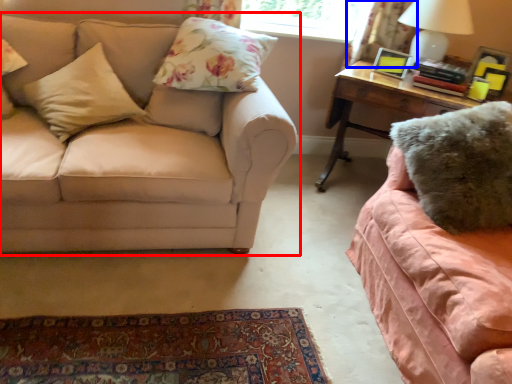
Question: Which object is closer to the camera taking this photo, studio couch (highlighted by a red box) or curtain (highlighted by a blue box)?

Choices:
 (A) studio couch
 (B) curtain

Answer: (A)